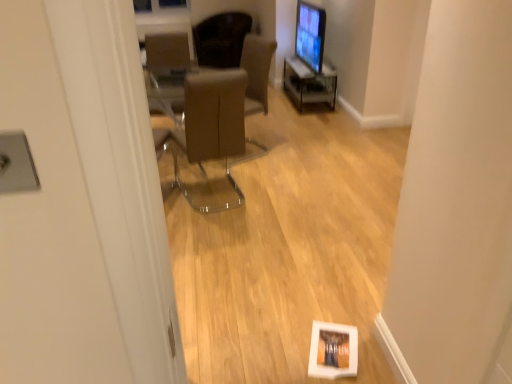
Locate an element on the screen. Image resolution: width=512 pixels, height=384 pixels. free location in front of brown leather chair at center, the third chair positioned from the back is located at coordinates (219, 232).